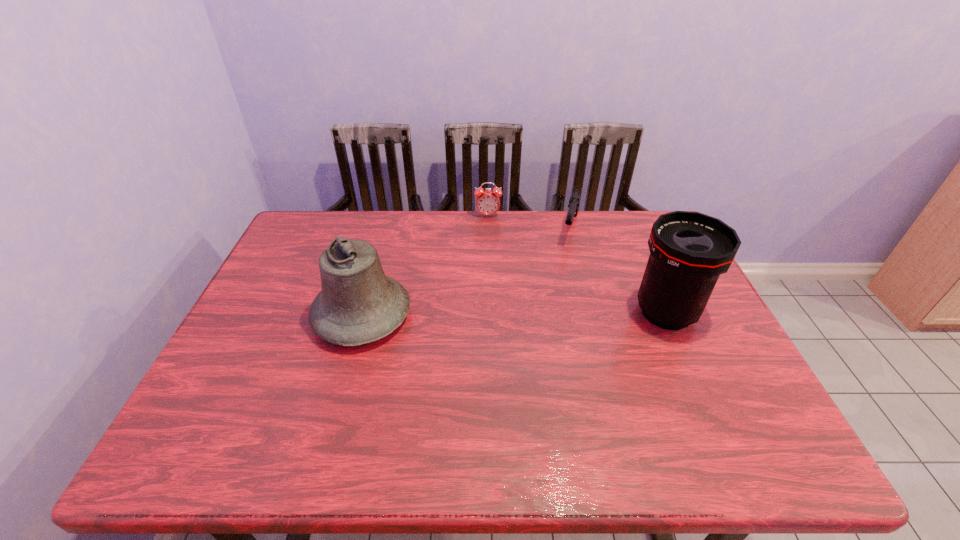
Locate an element on the screen. The height and width of the screenshot is (540, 960). vacant position located 0.230m at the end of the barrel of the third object from left to right is located at coordinates (560, 296).

Find the location of a particular element. Image resolution: width=960 pixels, height=540 pixels. free region located 0.120m at the end of the barrel of the third object from left to right is located at coordinates (565, 272).

In order to click on alarm clock at the far edge in this screenshot , I will do `click(487, 202)`.

Identify the location of gun situated at the far edge. (575, 198).

Image resolution: width=960 pixels, height=540 pixels. Identify the location of object present at the right edge. (688, 250).

Identify the location of vacant area at the far edge of the desktop. The image size is (960, 540). (515, 222).

In the image, there is a desktop. Where is `vacant space at the near edge`? vacant space at the near edge is located at coordinates (552, 398).

This screenshot has width=960, height=540. In order to click on free space at the left edge of the desktop in this screenshot , I will do `click(286, 312)`.

The height and width of the screenshot is (540, 960). What are the coordinates of `free space at the right edge of the desktop` in the screenshot? It's located at (690, 361).

Where is `free space at the far left corner of the desktop`? The width and height of the screenshot is (960, 540). free space at the far left corner of the desktop is located at coordinates (328, 211).